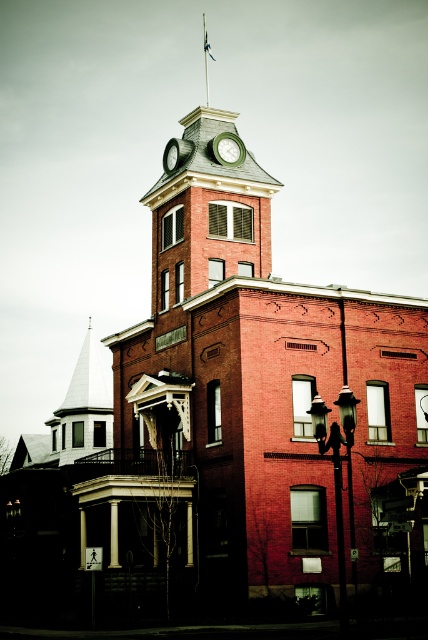
You are an architect reviewing the building plans. You notice two green clocks on the clock tower. The green matte clock at upper center and the green metallic clock at center. Which one is bigger?

The green matte clock at upper center is larger than the green metallic clock at center according to the description.

You are an architect inspecting the building. You notice the white spire at left and the green matte clock at upper center. Which of these two objects has a greater height?

The white spire at left is larger in size than the green matte clock at upper center, so it has a greater height.